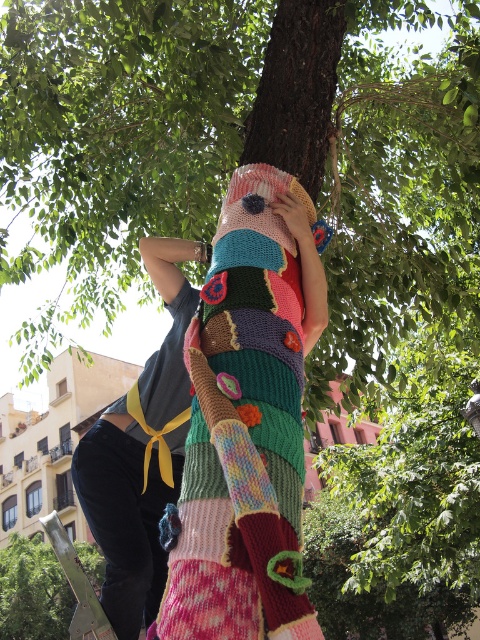
Based on the scene described, where is the knitted multicolored blanket at center in relation to the wooden post at lower left?

The knitted multicolored blanket at center is to the right of the wooden post at lower left.

You are a city planner assessing public art installations. You notice the knitted multicolored blanket at center and the wooden post at lower left in the image. Which object is shorter in height?

The knitted multicolored blanket at center is not as tall as the wooden post at lower left, so the knitted multicolored blanket at center is shorter in height.